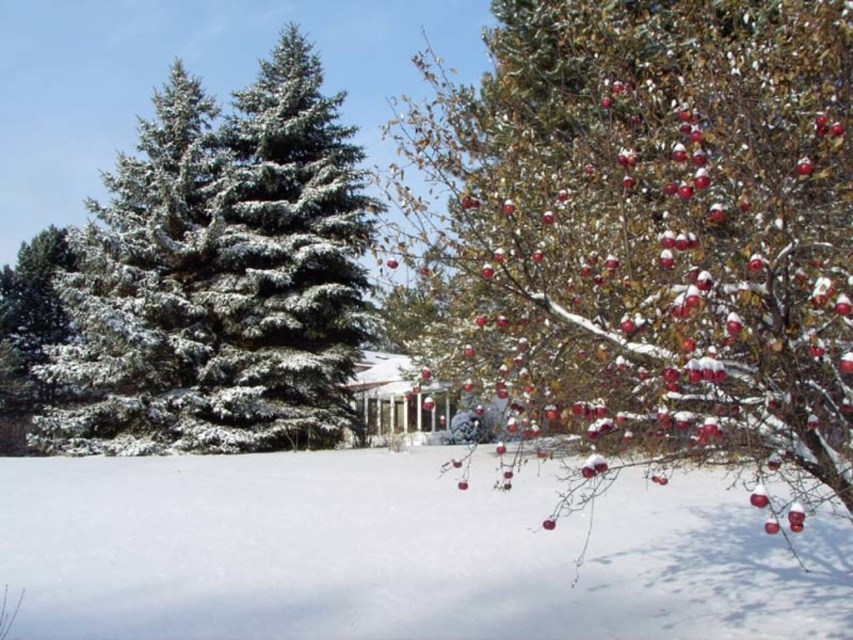
Question: Is white fluffy snow at lower center positioned in front of snow-covered evergreen tree at left?

Choices:
 (A) no
 (B) yes

Answer: (B)

Question: Is white fluffy snow at lower center behind snow-covered evergreen tree at left?

Choices:
 (A) yes
 (B) no

Answer: (B)

Question: Which object is closer to the camera taking this photo?

Choices:
 (A) snow-covered evergreen tree at left
 (B) white fluffy snow at lower center

Answer: (B)

Question: Can you confirm if white fluffy snow at lower center is positioned above snow-covered evergreen tree at left?

Choices:
 (A) no
 (B) yes

Answer: (A)

Question: Among these points, which one is farthest from the camera?

Choices:
 (A) (132, 248)
 (B) (395, 620)

Answer: (A)